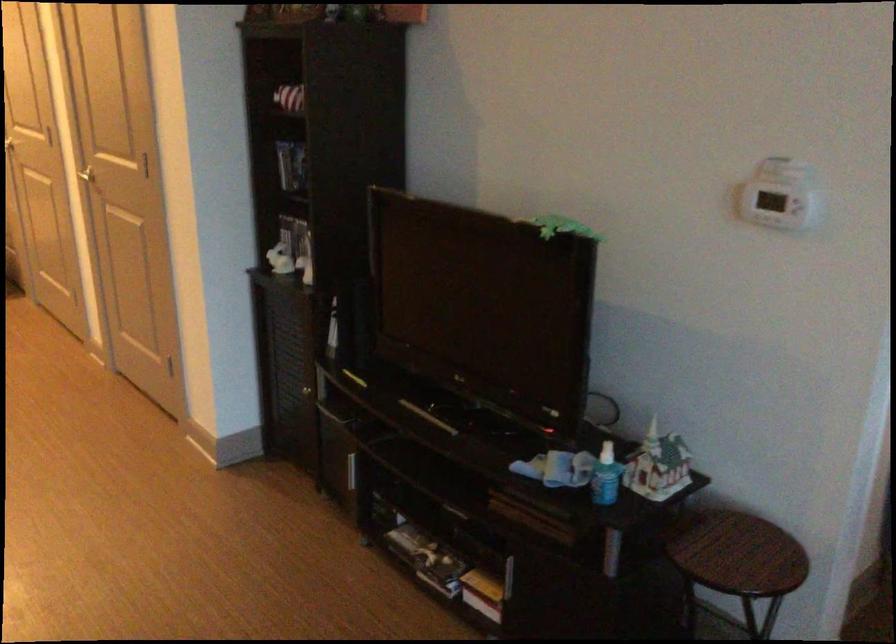
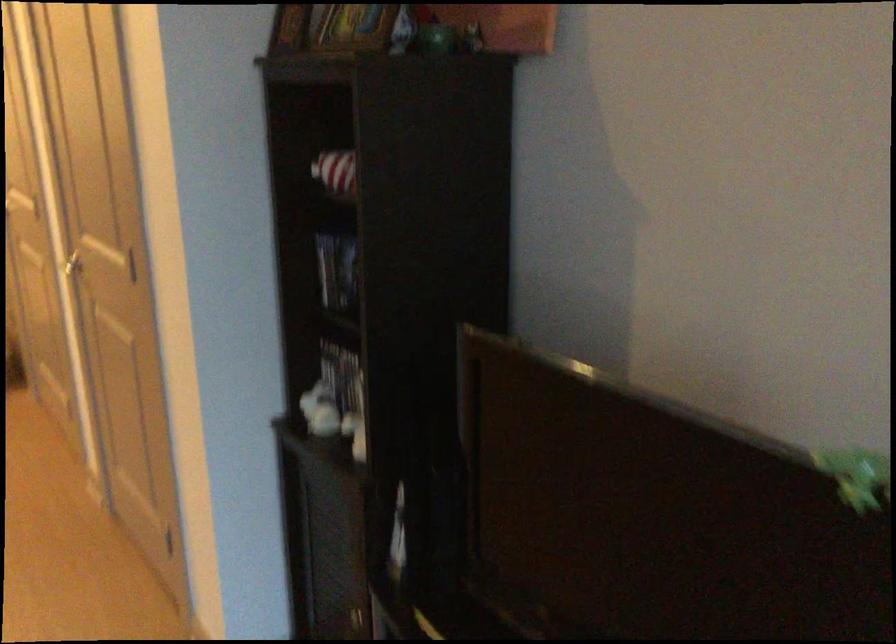
Find the pixel in the second image that matches [288,91] in the first image.

(336, 172)